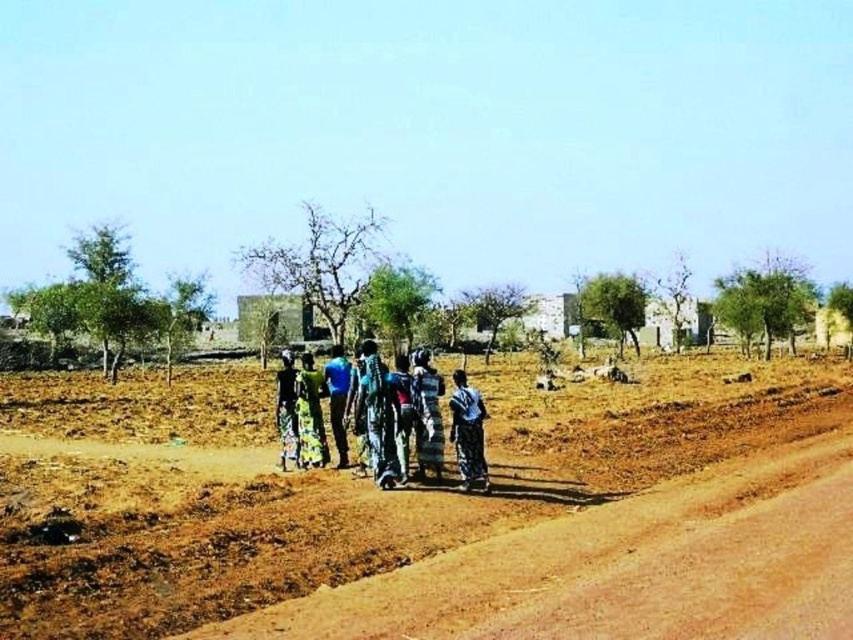
Question: Observing the image, what is the correct spatial positioning of brown dirt field at center in reference to blue fabric person at center?

Choices:
 (A) left
 (B) right

Answer: (B)

Question: Which point is closer to the camera?

Choices:
 (A) (57, 572)
 (B) (346, 401)
 (C) (436, 417)
 (D) (363, 403)

Answer: (A)

Question: Which point appears farthest from the camera in this image?

Choices:
 (A) (419, 454)
 (B) (289, 436)
 (C) (463, 384)

Answer: (B)

Question: Observing the image, what is the correct spatial positioning of textured fabric dress at center in reference to printed fabric dress at center?

Choices:
 (A) below
 (B) above

Answer: (A)

Question: Which object appears farthest from the camera in this image?

Choices:
 (A) blue fabric person at center
 (B) light blue fabric at center
 (C) textured fabric dress at center

Answer: (A)

Question: Does brown dirt field at center have a greater width compared to dark green fabric at center?

Choices:
 (A) yes
 (B) no

Answer: (A)